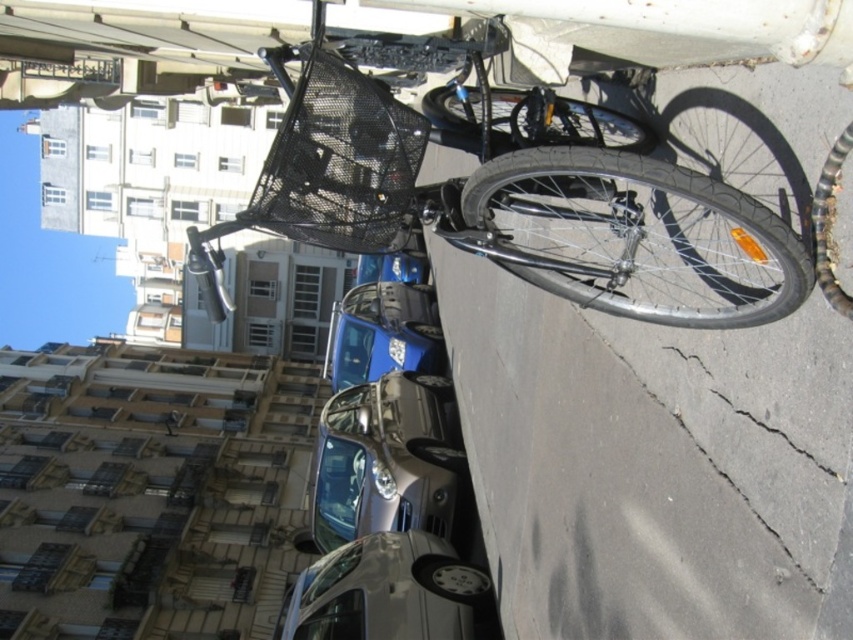
Does shiny silver car at center lie behind silver metallic car at center?

Yes, it is behind silver metallic car at center.

Does point (347, 481) lie behind point (363, 586)?

Yes.

The image size is (853, 640). I want to click on shiny silver car at center, so click(x=386, y=460).

Is shiny black bicycle at center smaller than metallic blue car at center?

No.

Is point (341, 244) closer to viewer compared to point (427, 349)?

That is True.

Find the location of `shiny black bicycle at center`. shiny black bicycle at center is located at coordinates (505, 189).

Between silver metallic car at center and metallic blue car at center, which one is positioned higher?

Positioned higher is metallic blue car at center.

How far apart are silver metallic car at center and metallic blue car at center?

silver metallic car at center and metallic blue car at center are 18.72 meters apart.

Does point (466, 564) come behind point (387, 301)?

No, it is not.

Locate an element on the screen. silver metallic car at center is located at coordinates (389, 593).